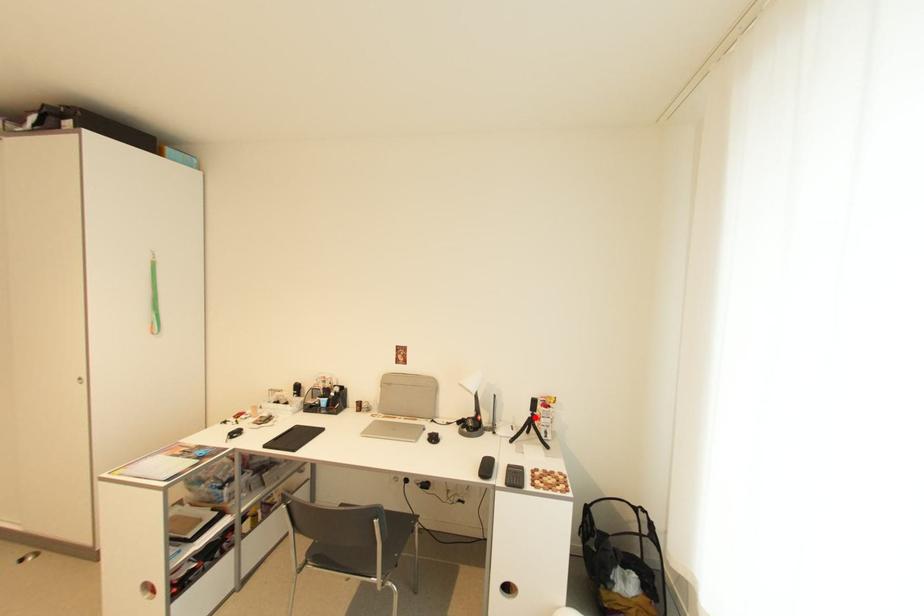
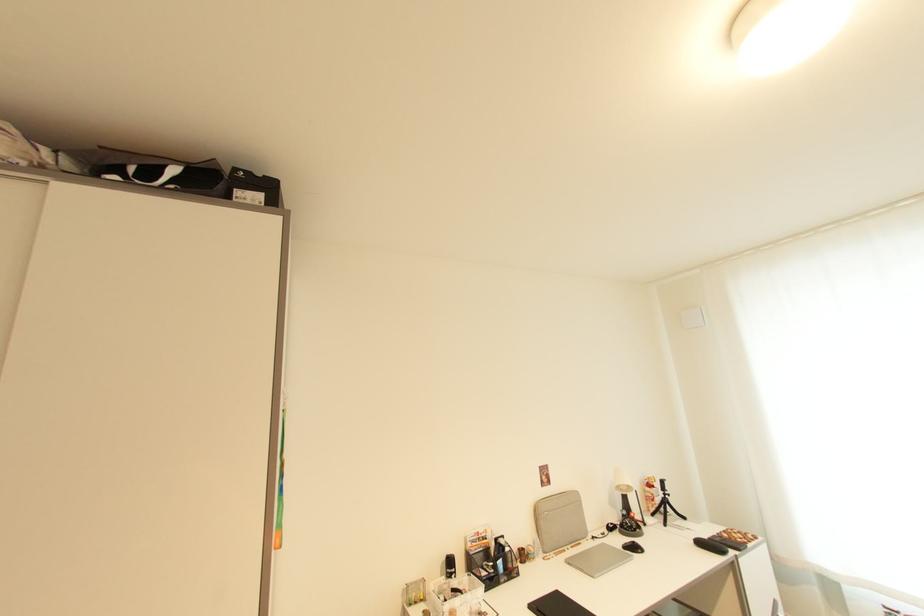
In the second image, find the point that corresponds to the highlighted location in the first image.

(669, 498)